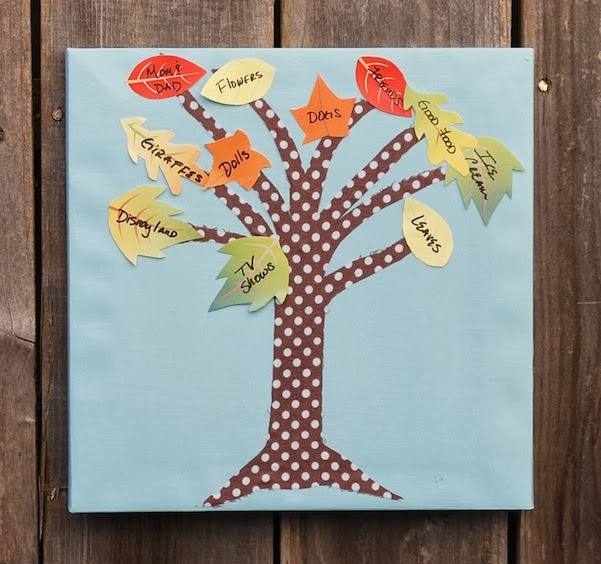
Identify the location of brown wooden wall. (257, 27).